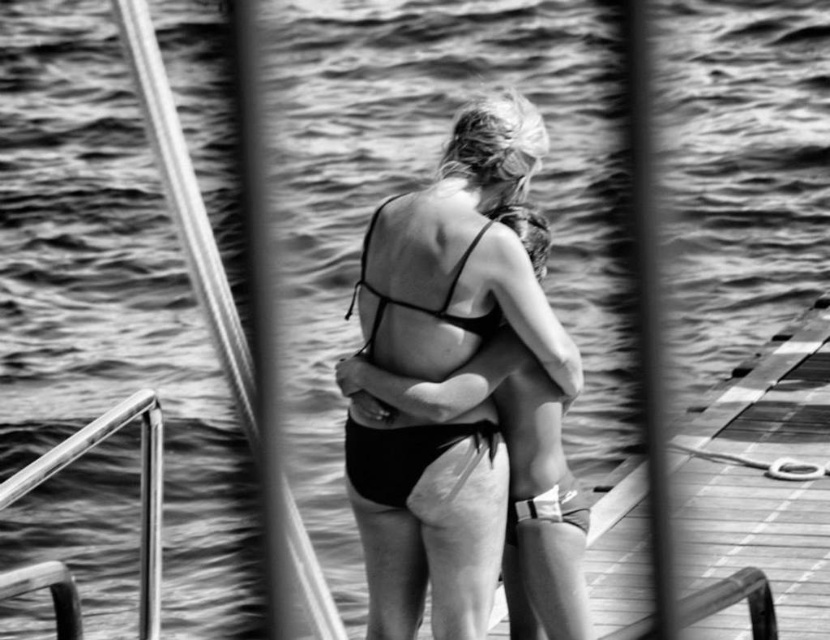
Which is more to the right, black matte swimsuit at center or polished metal rail at left?

black matte swimsuit at center

Does black matte swimsuit at center come behind polished metal rail at left?

Yes, it is behind polished metal rail at left.

Is point (370, 285) positioned behind point (30, 465)?

Yes, it is behind point (30, 465).

Where is `black matte swimsuit at center`? black matte swimsuit at center is located at coordinates point(466,266).

Does black matte swimsuit at center appear over black matte bikini top at center?

No.

Does black matte swimsuit at center appear on the left side of black matte bikini top at center?

Incorrect, black matte swimsuit at center is not on the left side of black matte bikini top at center.

This screenshot has width=830, height=640. I want to click on black matte swimsuit at center, so [x=466, y=266].

Does polished metal rail at left have a lesser height compared to black matte bikini at center?

In fact, polished metal rail at left may be taller than black matte bikini at center.

Consider the image. Which is more to the right, polished metal rail at left or black matte bikini at center?

black matte bikini at center is more to the right.

Where is `polished metal rail at left`? Image resolution: width=830 pixels, height=640 pixels. polished metal rail at left is located at coordinates (140, 486).

At what (x,y) coordinates should I click in order to perform the action: click on polished metal rail at left. Please return your answer as a coordinate pair (x, y). The image size is (830, 640). Looking at the image, I should click on (x=140, y=486).